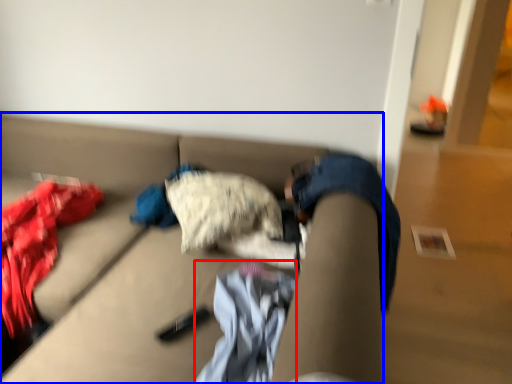
Question: Which of the following is the farthest to the observer, baby clothe (highlighted by a red box) or studio couch (highlighted by a blue box)?

Choices:
 (A) baby clothe
 (B) studio couch

Answer: (A)